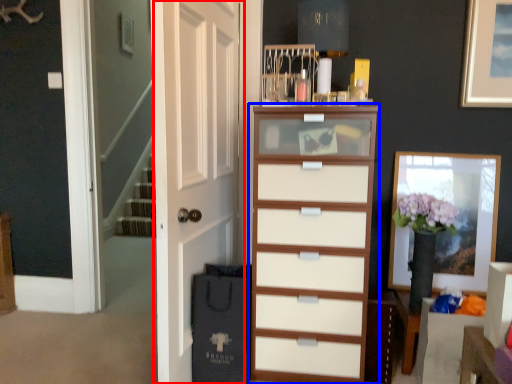
Question: Among these objects, which one is farthest to the camera, door (highlighted by a red box) or chest of drawers (highlighted by a blue box)?

Choices:
 (A) door
 (B) chest of drawers

Answer: (B)